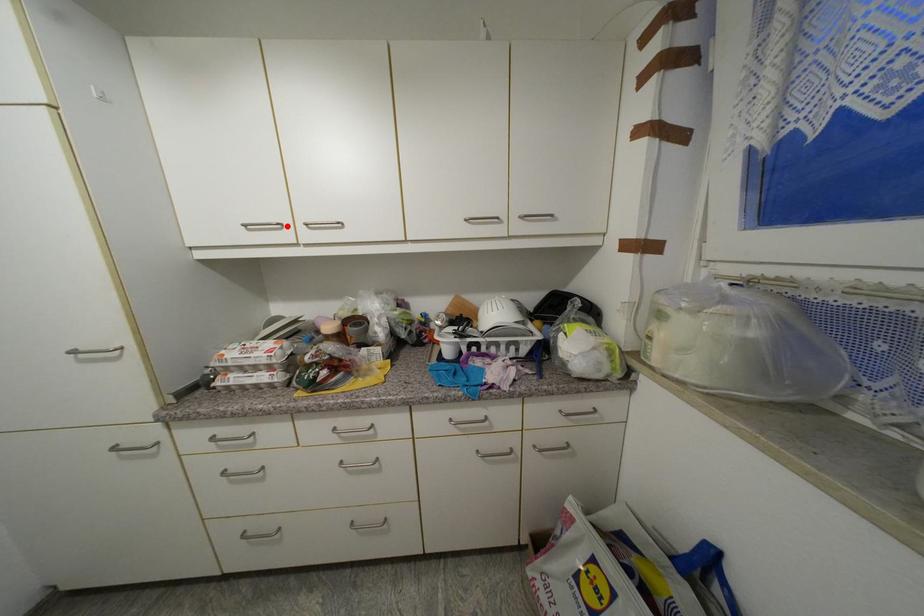
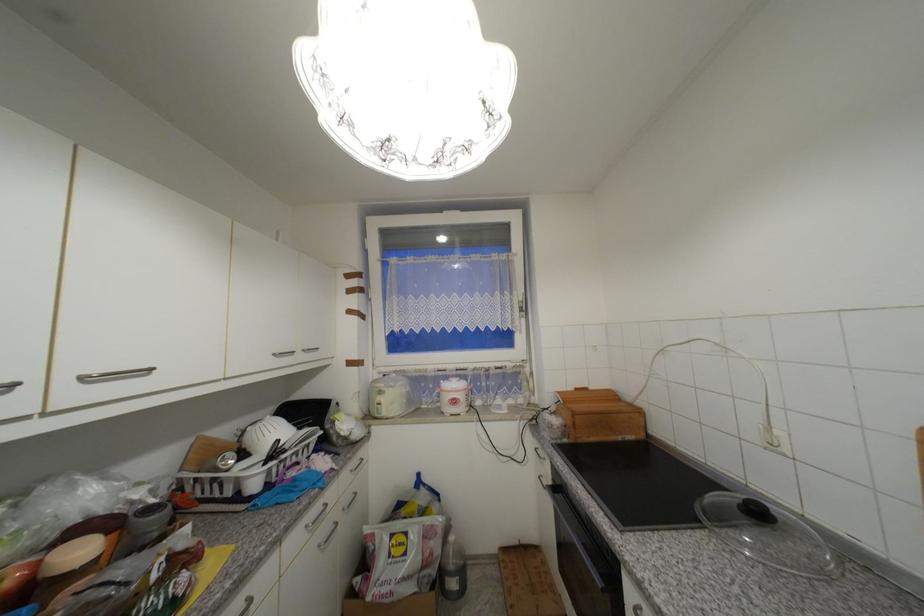
Find the pixel in the second image that matches the highlighted location in the first image.

(19, 386)